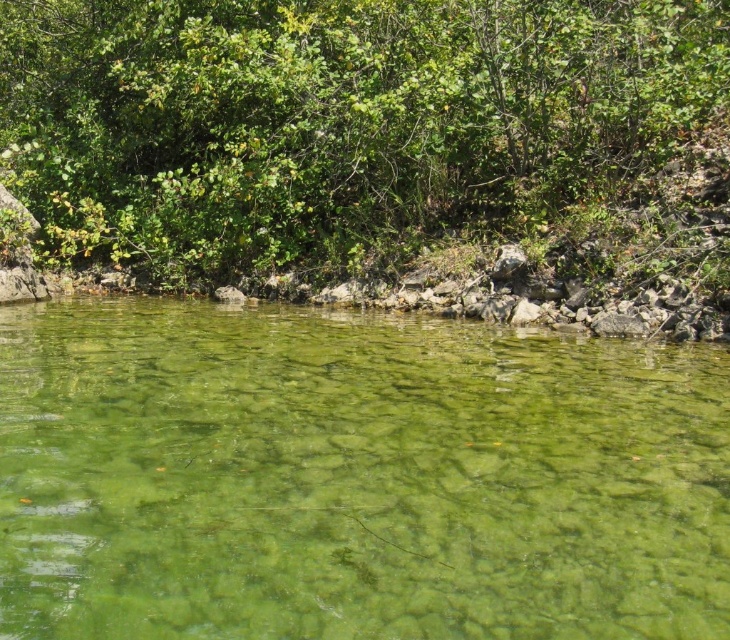
Can you confirm if clear water at center is taller than green leafy bush at upper center?

Incorrect, clear water at center's height is not larger of green leafy bush at upper center's.

Does point (491, 477) come closer to viewer compared to point (604, 147)?

Yes, it is.

Where is `clear water at center`? Image resolution: width=730 pixels, height=640 pixels. clear water at center is located at coordinates (353, 476).